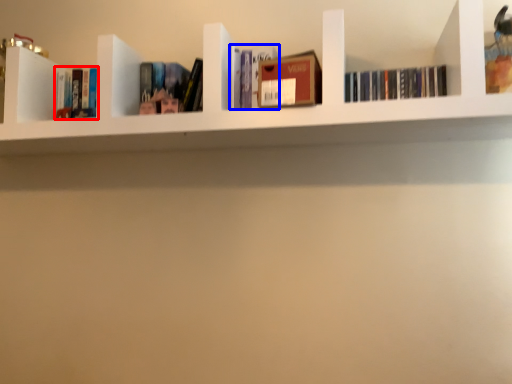
Question: Among these objects, which one is nearest to the camera, book (highlighted by a red box) or book (highlighted by a blue box)?

Choices:
 (A) book
 (B) book

Answer: (B)